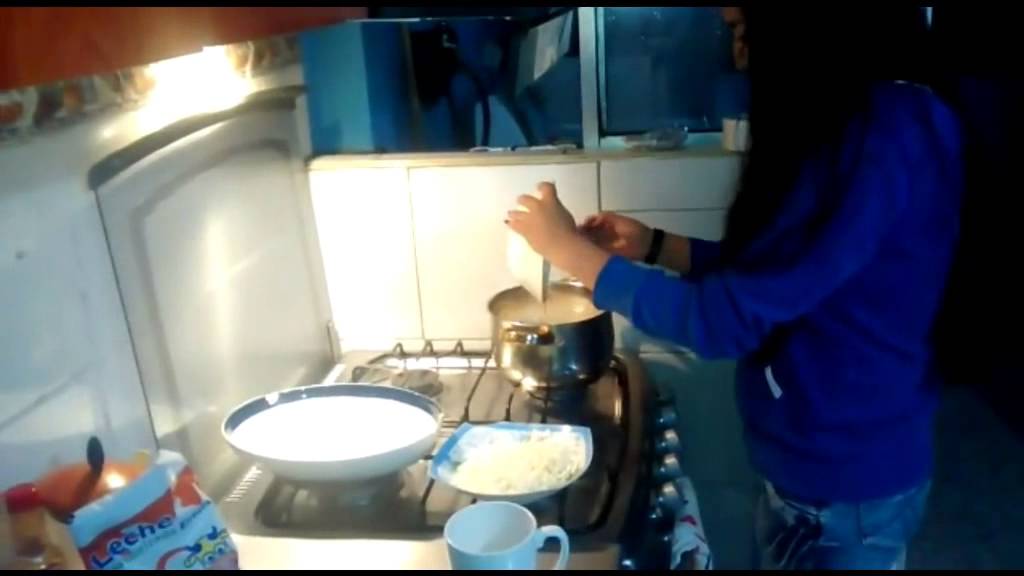
Where is `bowl`? This screenshot has width=1024, height=576. bowl is located at coordinates (391, 425).